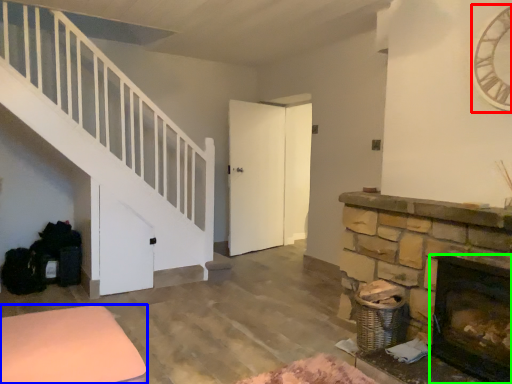
Question: Which object is the farthest from clock (highlighted by a red box)? Choose among these: furniture (highlighted by a blue box) or fireplace (highlighted by a green box).

Choices:
 (A) furniture
 (B) fireplace

Answer: (A)